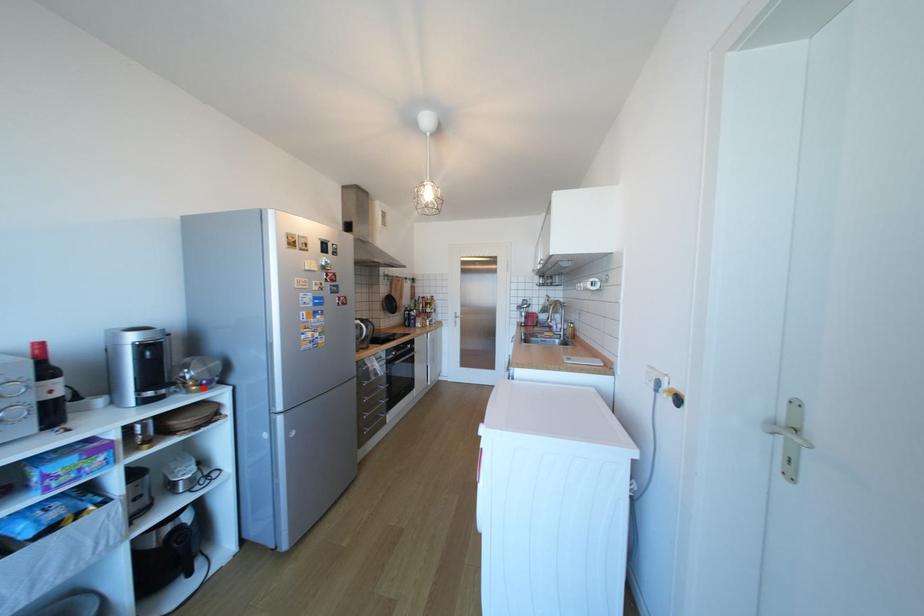
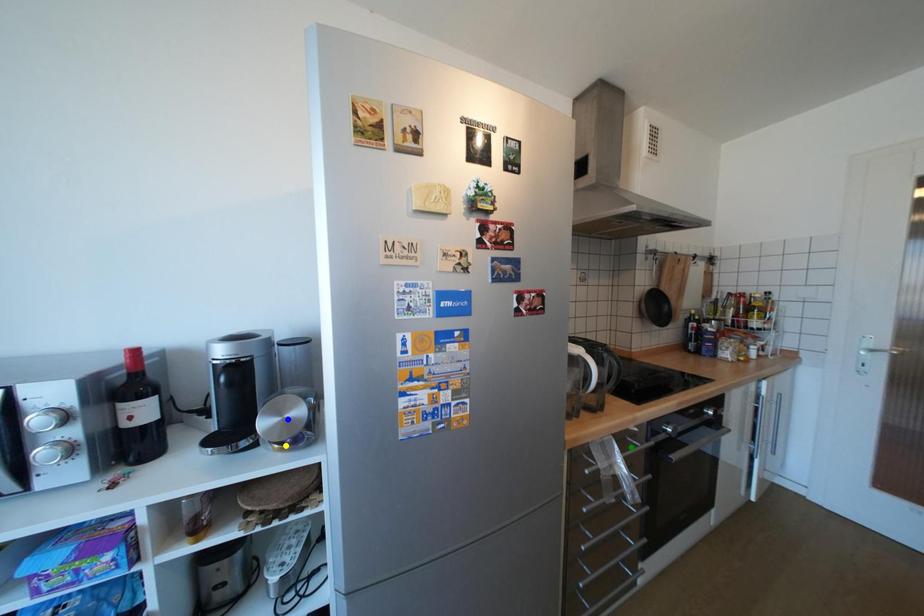
Question: I am providing you with two images of the same scene from different viewpoints. A red point is marked on the first image. You are given multiple points on the second image. Which point in image 2 represents the same 3d spot as the red point in image 1?

Choices:
 (A) yellow point
 (B) green point
 (C) blue point

Answer: (A)